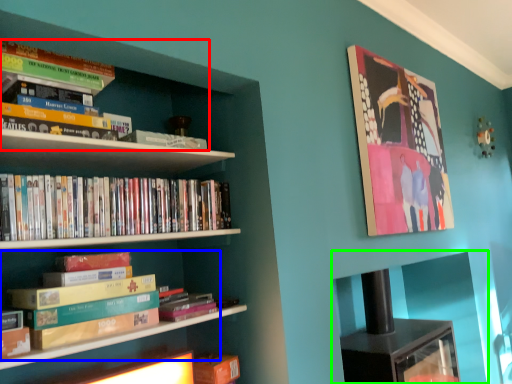
Question: Which object is the farthest from book (highlighted by a red box)? Choose among these: book (highlighted by a blue box) or cabinet (highlighted by a green box).

Choices:
 (A) book
 (B) cabinet

Answer: (B)